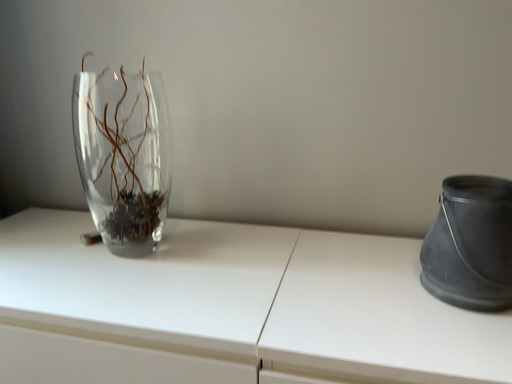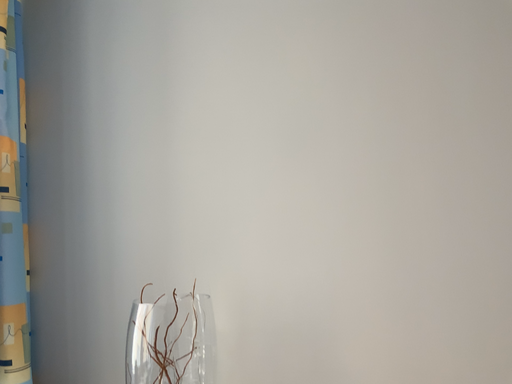
Question: How did the camera likely rotate when shooting the video?

Choices:
 (A) rotated upward
 (B) rotated downward

Answer: (A)